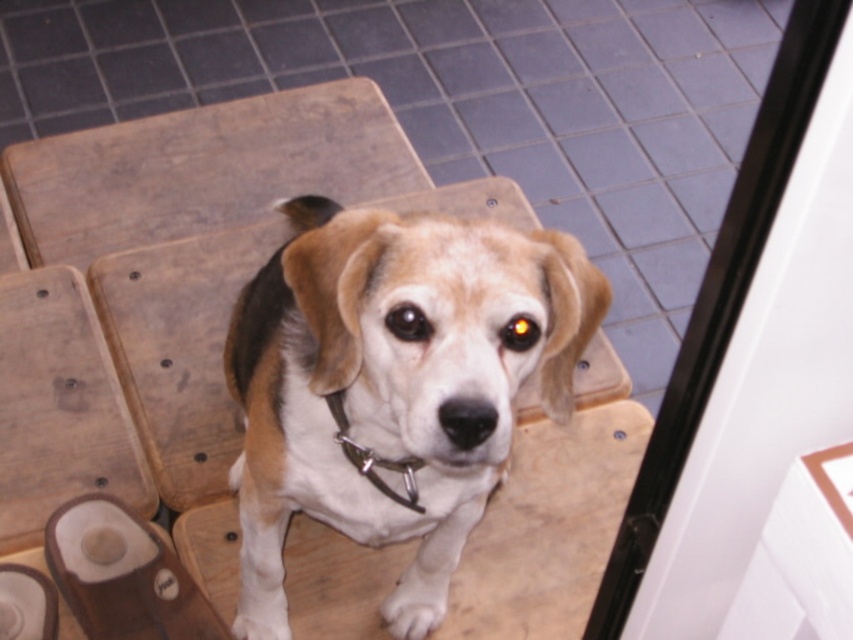
Question: In this image, where is light brown leather sandal at lower left located relative to metallic chain at center?

Choices:
 (A) left
 (B) right

Answer: (A)

Question: Which object appears closest to the camera in this image?

Choices:
 (A) metallic chain at center
 (B) transparent glass door at upper right
 (C) light brown leather sandal at lower left

Answer: (B)

Question: Does brown and white fur dog at center have a larger size compared to light brown leather sandal at lower left?

Choices:
 (A) no
 (B) yes

Answer: (B)

Question: Which of the following is the closest to the observer?

Choices:
 (A) brown and white fur dog at center
 (B) light brown leather sandal at lower left
 (C) transparent glass door at upper right
 (D) metallic chain at center

Answer: (C)

Question: Which object is positioned farthest from the metallic chain at center?

Choices:
 (A) brown and white fur dog at center
 (B) light brown leather sandal at lower left

Answer: (B)

Question: Is the position of transparent glass door at upper right more distant than that of metallic chain at center?

Choices:
 (A) yes
 (B) no

Answer: (B)